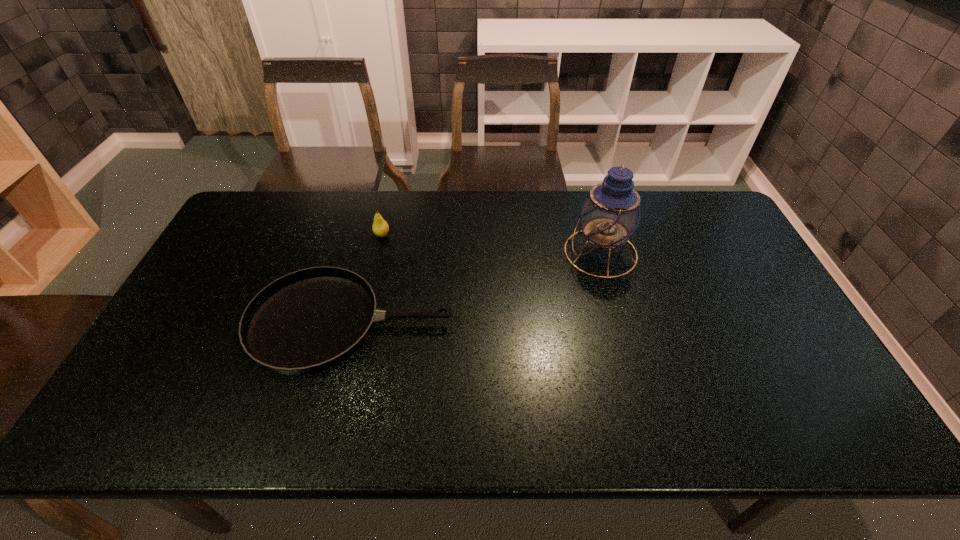
This screenshot has width=960, height=540. I want to click on free space that satisfies the following two spatial constraints: 1. on the front side of the pear; 2. on the handle side of the frying pan, so [x=361, y=323].

Find the location of a particular element. The width and height of the screenshot is (960, 540). free space that satisfies the following two spatial constraints: 1. on the front side of the second tallest object; 2. on the handle side of the frying pan is located at coordinates (361, 323).